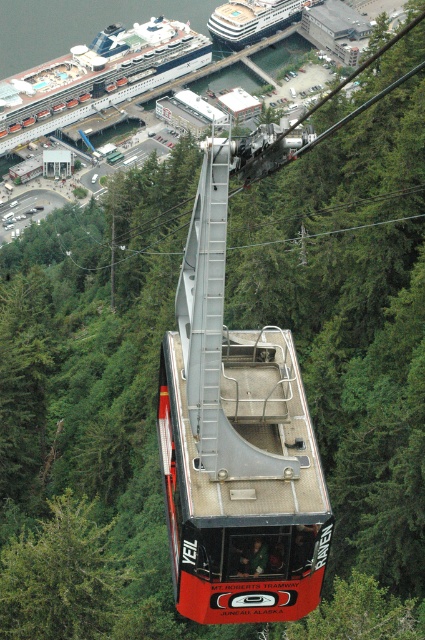
Identify the location of red matte cable car at center. The width and height of the screenshot is (425, 640). (235, 442).

In the scene shown: Is red matte cable car at center bigger than white glossy cruise ship at upper left?

Actually, red matte cable car at center might be smaller than white glossy cruise ship at upper left.

You are a GUI agent. You are given a task and a screenshot of the screen. Output one action in this format:
    pyautogui.click(x=<x>, y=<y>)
    Task: Click on the red matte cable car at center
    The height and width of the screenshot is (640, 425).
    Given the screenshot: What is the action you would take?
    pyautogui.click(x=235, y=442)

Consider the image. Does green leafy tree at center have a greater width compared to white glossy cruise ship at upper left?

No.

Can you confirm if green leafy tree at center is thinner than white glossy cruise ship at upper left?

Indeed, green leafy tree at center has a lesser width compared to white glossy cruise ship at upper left.

Does point (36, 544) come farther from viewer compared to point (28, 140)?

No.

The image size is (425, 640). Find the location of `green leafy tree at center`. green leafy tree at center is located at coordinates (62, 577).

Can you confirm if red matte cable car at center is positioned to the left of green leafy tree at center?

In fact, red matte cable car at center is to the right of green leafy tree at center.

Is point (195, 282) more distant than point (85, 518)?

No, it is in front of (85, 518).

This screenshot has width=425, height=640. Identify the location of red matte cable car at center. (235, 442).

Identify the location of red matte cable car at center. This screenshot has height=640, width=425. (235, 442).